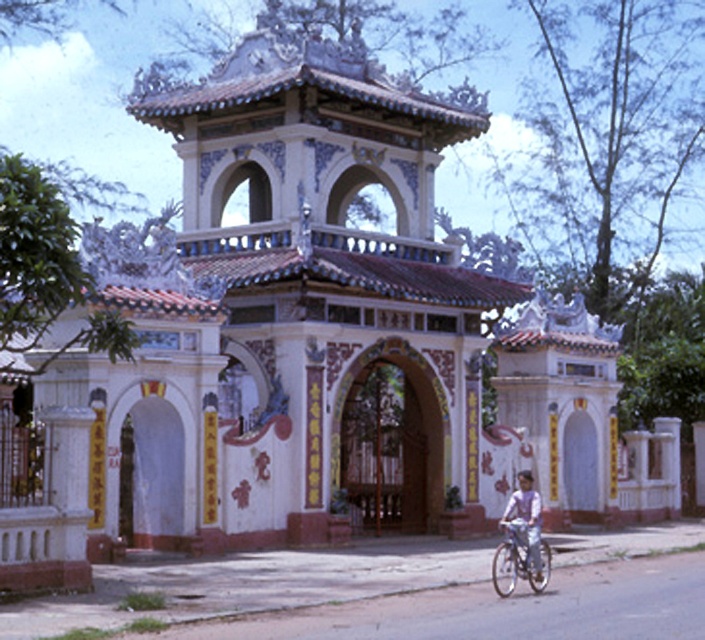
Can you confirm if wooden carved gate at center is shorter than light purple shirt at lower right?

Incorrect, wooden carved gate at center's height does not fall short of light purple shirt at lower right's.

Between point (379, 353) and point (537, 493), which one is positioned in front?

Point (537, 493)

You are a GUI agent. You are given a task and a screenshot of the screen. Output one action in this format:
    pyautogui.click(x=<x>, y=<y>)
    Task: Click on the wooden carved gate at center
    
    Given the screenshot: What is the action you would take?
    pyautogui.click(x=391, y=440)

This screenshot has width=705, height=640. What are the coordinates of `wooden carved gate at center` in the screenshot? It's located at (391, 440).

Who is more distant from viewer, (x=135, y=390) or (x=532, y=532)?

Positioned behind is point (x=135, y=390).

Is white painted stone archway at center positioned at the back of light purple shirt at lower right?

Yes, white painted stone archway at center is behind light purple shirt at lower right.

This screenshot has width=705, height=640. Describe the element at coordinates (149, 467) in the screenshot. I see `white painted stone archway at center` at that location.

This screenshot has height=640, width=705. I want to click on white painted stone archway at center, so click(x=149, y=467).

Is silver metallic bicycle at lower right wider than light purple shirt at lower right?

Incorrect, silver metallic bicycle at lower right's width does not surpass light purple shirt at lower right's.

Which is in front, point (501, 554) or point (539, 566)?

Point (539, 566) is more forward.

Is point (515, 572) more distant than point (515, 525)?

No, it is not.

Where is `silver metallic bicycle at lower right`? This screenshot has width=705, height=640. silver metallic bicycle at lower right is located at coordinates (517, 563).